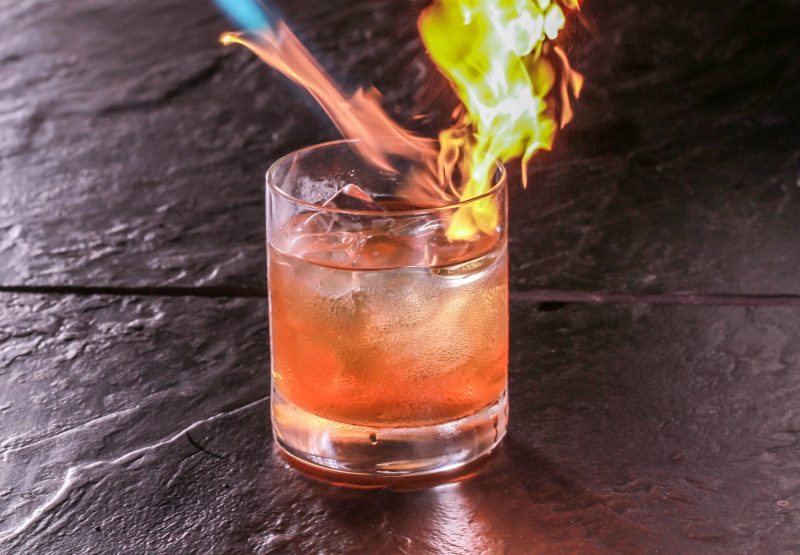
The width and height of the screenshot is (800, 555). Identify the location of black table. [737, 218].